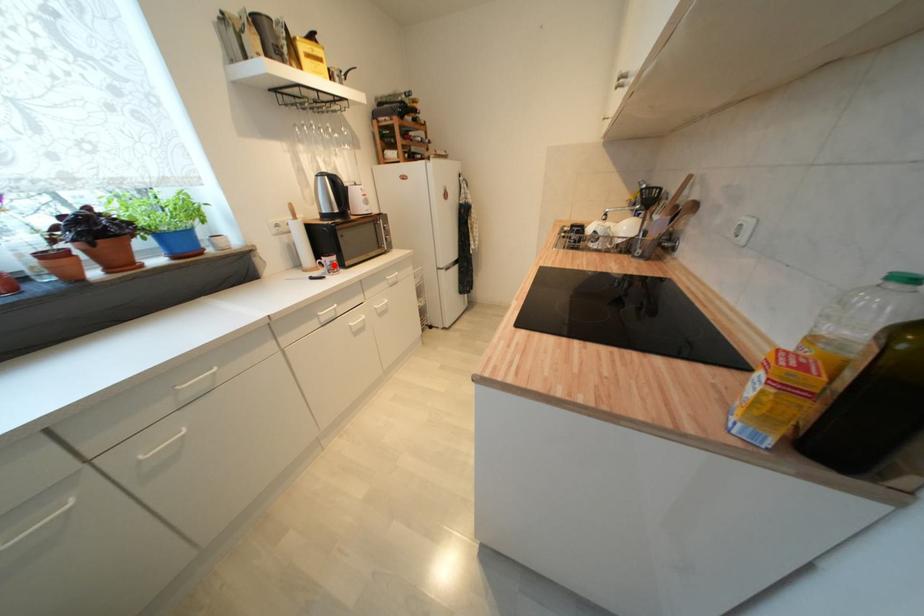
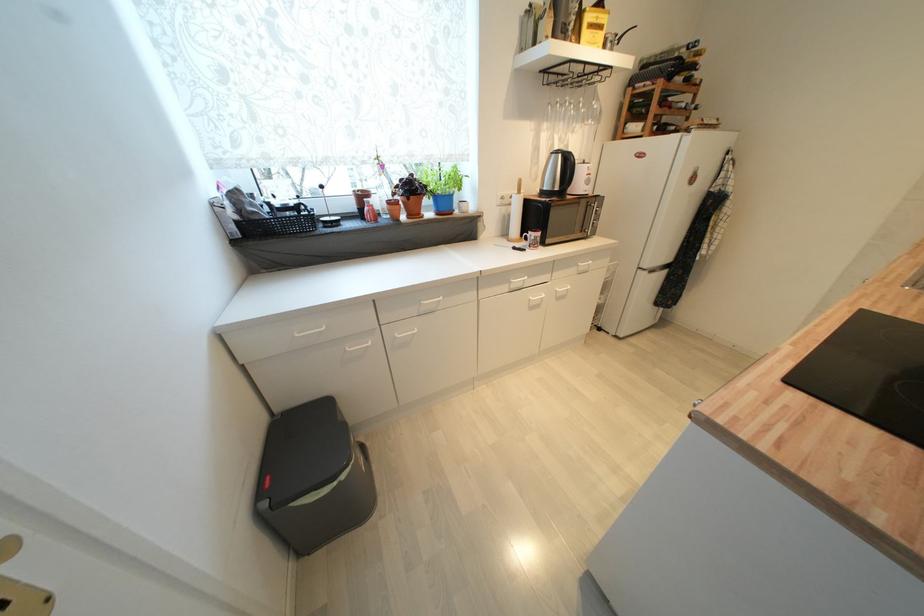
In the second image, find the point that corresponds to the highlighted location in the first image.

(538, 240)